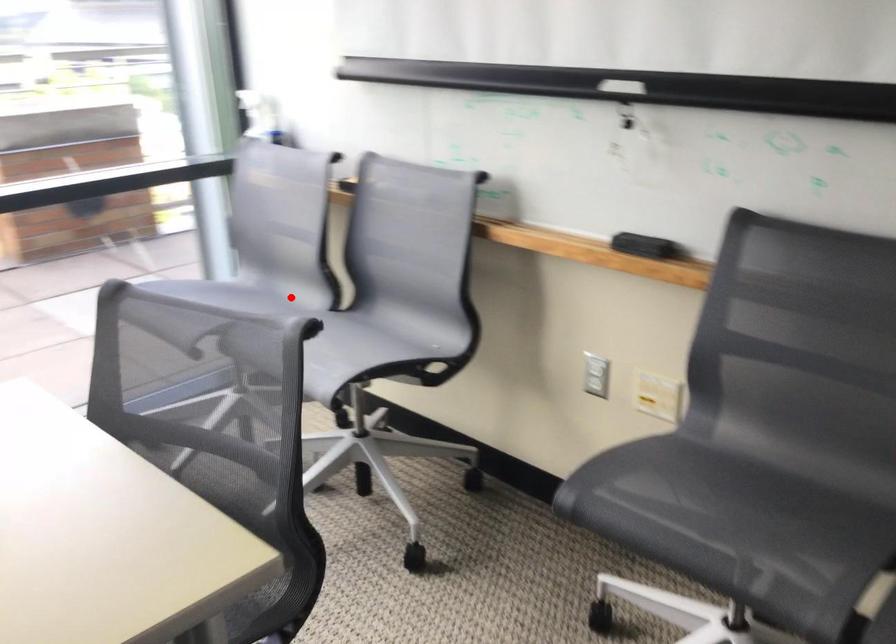
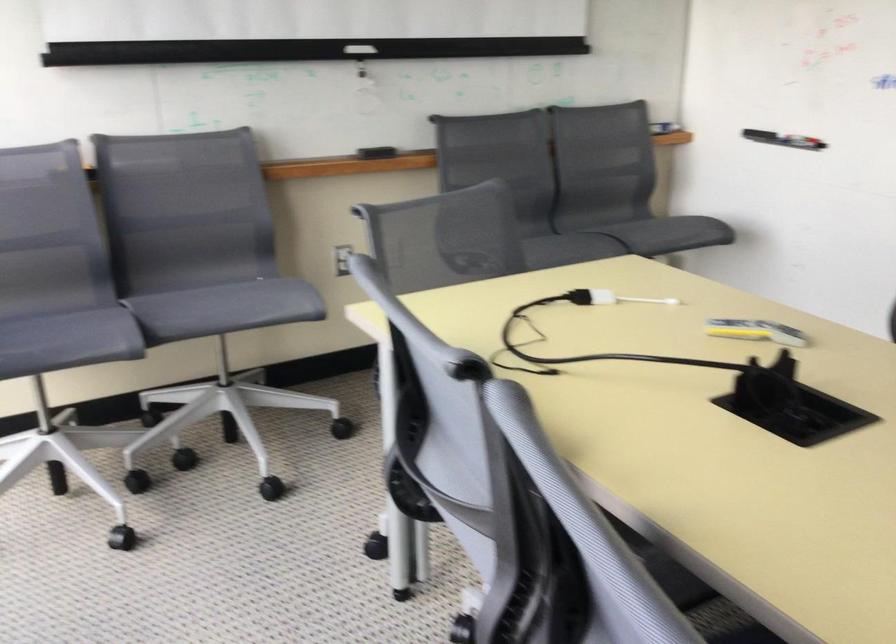
In the second image, find the point that corresponds to the highlighted location in the first image.

(58, 305)